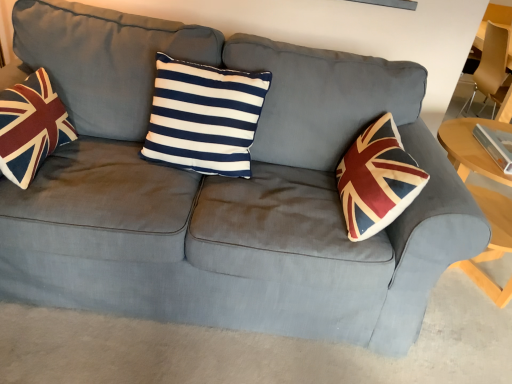
Question: Would you say light wood table at right is a long distance from navy/white striped cushion at center?

Choices:
 (A) yes
 (B) no

Answer: (A)

Question: Does light wood table at right have a smaller size compared to navy/white striped cushion at center?

Choices:
 (A) no
 (B) yes

Answer: (A)

Question: Can you confirm if light wood table at right is bigger than navy/white striped cushion at center?

Choices:
 (A) no
 (B) yes

Answer: (B)

Question: Are light wood table at right and navy/white striped cushion at center making contact?

Choices:
 (A) yes
 (B) no

Answer: (B)

Question: Would you say light wood table at right is outside navy/white striped cushion at center?

Choices:
 (A) yes
 (B) no

Answer: (A)

Question: From a real-world perspective, is velvet union jack pillow at left positioned above or below light wood table at right?

Choices:
 (A) above
 (B) below

Answer: (A)

Question: Visually, is velvet union jack pillow at left positioned to the left or to the right of light wood table at right?

Choices:
 (A) right
 (B) left

Answer: (B)

Question: In terms of height, does velvet union jack pillow at left look taller or shorter compared to light wood table at right?

Choices:
 (A) tall
 (B) short

Answer: (B)

Question: Considering the positions of velvet union jack pillow at left and light wood table at right in the image, is velvet union jack pillow at left wider or thinner than light wood table at right?

Choices:
 (A) thin
 (B) wide

Answer: (A)

Question: Considering the positions of velvet union jack pillow at left and matte brown armchair at right in the image, is velvet union jack pillow at left taller or shorter than matte brown armchair at right?

Choices:
 (A) short
 (B) tall

Answer: (A)

Question: Looking at the image, does velvet union jack pillow at left seem bigger or smaller compared to matte brown armchair at right?

Choices:
 (A) small
 (B) big

Answer: (A)

Question: Is velvet union jack pillow at left to the left or to the right of matte brown armchair at right in the image?

Choices:
 (A) right
 (B) left

Answer: (B)

Question: Is point (39, 104) positioned closer to the camera than point (492, 49)?

Choices:
 (A) farther
 (B) closer

Answer: (B)

Question: Is velvet union jack pillow at left taller or shorter than navy/white striped cushion at center?

Choices:
 (A) short
 (B) tall

Answer: (A)

Question: Looking at the image, does velvet union jack pillow at left seem bigger or smaller compared to navy/white striped cushion at center?

Choices:
 (A) big
 (B) small

Answer: (B)